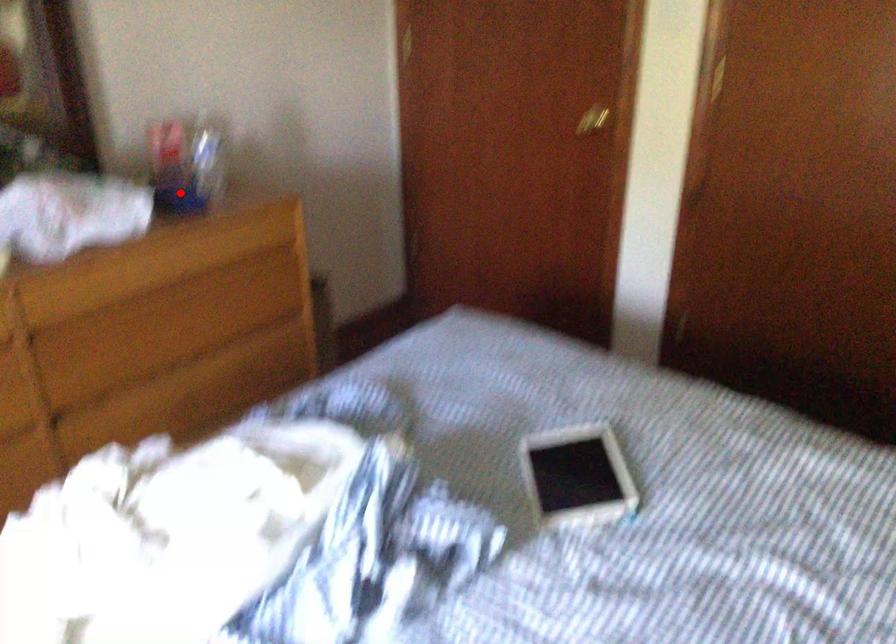
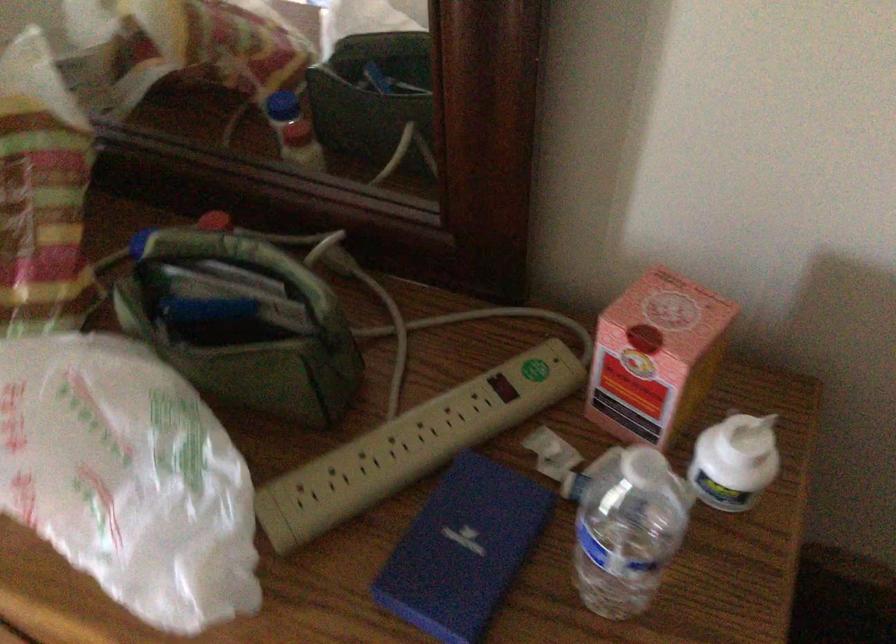
In the second image, find the point that corresponds to the highlighted location in the first image.

(462, 550)